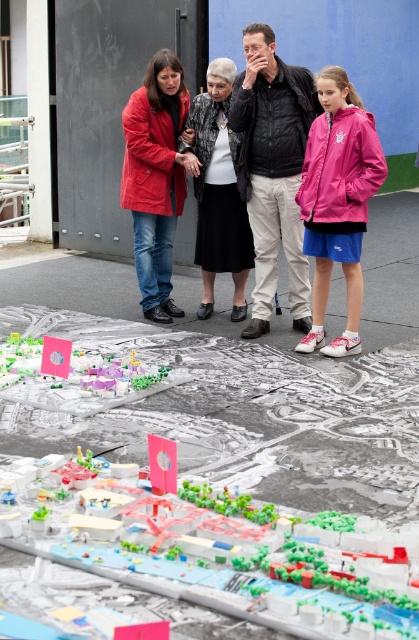
Can you confirm if matte black jacket at center is positioned to the left of black matte skirt at center?

In fact, matte black jacket at center is to the right of black matte skirt at center.

Locate an element on the screen. matte black jacket at center is located at coordinates (300, 180).

Is matte red jacket at center shorter than pink plastic flag at upper left?

No, matte red jacket at center is not shorter than pink plastic flag at upper left.

Can you confirm if matte red jacket at center is taller than pink plastic flag at upper left?

Yes, matte red jacket at center is taller than pink plastic flag at upper left.

Describe the element at coordinates (157, 177) in the screenshot. I see `matte red jacket at center` at that location.

Find the location of `matte red jacket at center`. matte red jacket at center is located at coordinates (157, 177).

Describe the element at coordinates (157, 177) in the screenshot. Image resolution: width=419 pixels, height=640 pixels. I see `matte red jacket at center` at that location.

The width and height of the screenshot is (419, 640). What do you see at coordinates (157, 177) in the screenshot?
I see `matte red jacket at center` at bounding box center [157, 177].

Identify the location of matte red jacket at center. (157, 177).